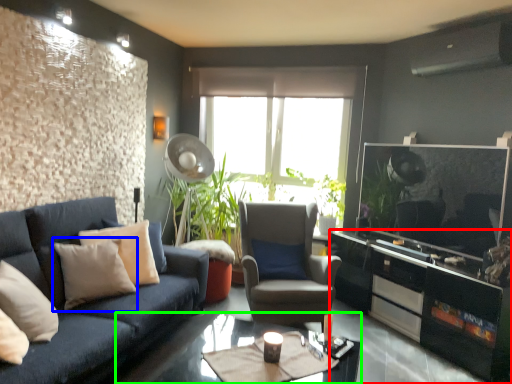
Question: Which object is the closest to the cabinetry (highlighted by a red box)? Choose among these: pillow (highlighted by a blue box) or coffee table (highlighted by a green box).

Choices:
 (A) pillow
 (B) coffee table

Answer: (B)